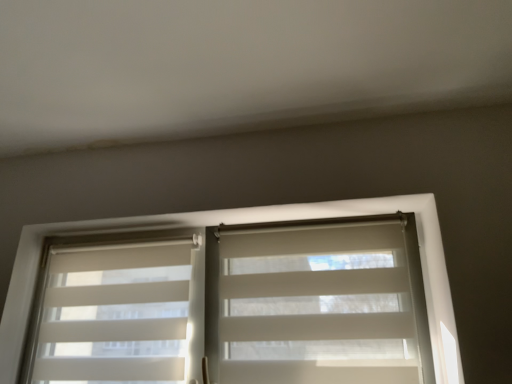
Question: Would you say white textured blinds at left is inside or outside white fabric blind at center?

Choices:
 (A) outside
 (B) inside

Answer: (A)

Question: From a real-world perspective, is white textured blinds at left physically located above or below white fabric blind at center?

Choices:
 (A) above
 (B) below

Answer: (A)

Question: Considering the real-world distances, which object is closest to the white textured blinds at left?

Choices:
 (A) white fabric blind at center
 (B) white translucent blinds at center

Answer: (B)

Question: Considering the real-world distances, which object is closest to the white textured blinds at left?

Choices:
 (A) white translucent blinds at center
 (B) white fabric blind at center

Answer: (A)